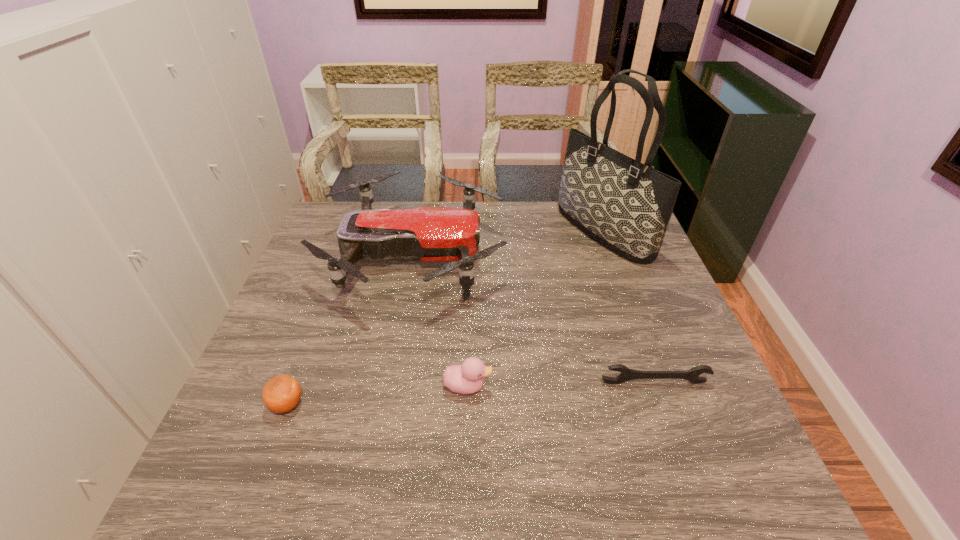
Image resolution: width=960 pixels, height=540 pixels. I want to click on tote bag that is at the far edge, so click(625, 205).

Where is `drone that is at the far edge`? Image resolution: width=960 pixels, height=540 pixels. drone that is at the far edge is located at coordinates (428, 234).

Locate an element on the screen. drone that is at the left edge is located at coordinates (428, 234).

This screenshot has width=960, height=540. Identify the location of orange at the left edge. (282, 393).

Locate an element on the screen. tote bag that is at the right edge is located at coordinates (625, 205).

Locate an element on the screen. wrench that is at the right edge is located at coordinates (692, 375).

Locate an element on the screen. The height and width of the screenshot is (540, 960). object that is at the far left corner is located at coordinates (428, 234).

At what (x,y) coordinates should I click in order to perform the action: click on object positioned at the far right corner. Please return your answer as a coordinate pair (x, y). This screenshot has height=540, width=960. Looking at the image, I should click on (625, 205).

Image resolution: width=960 pixels, height=540 pixels. I want to click on vacant space at the far edge, so click(572, 224).

I want to click on vacant space at the near edge of the desktop, so click(337, 497).